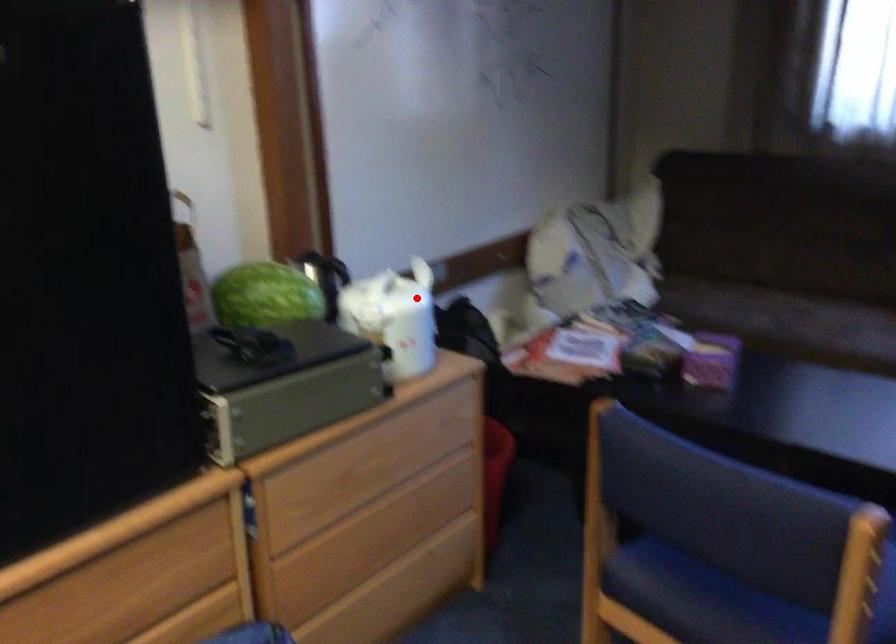
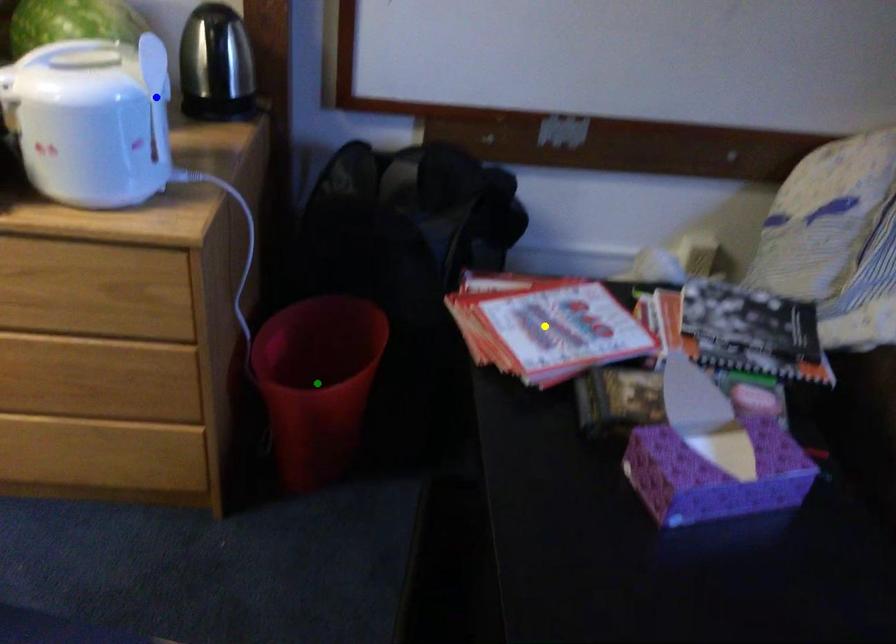
Question: I am providing you with two images of the same scene from different viewpoints. A red point is marked on the first image. You are given multiple points on the second image. Which spot in image 2 lines up with the point in image 1?

Choices:
 (A) green point
 (B) blue point
 (C) yellow point

Answer: (B)